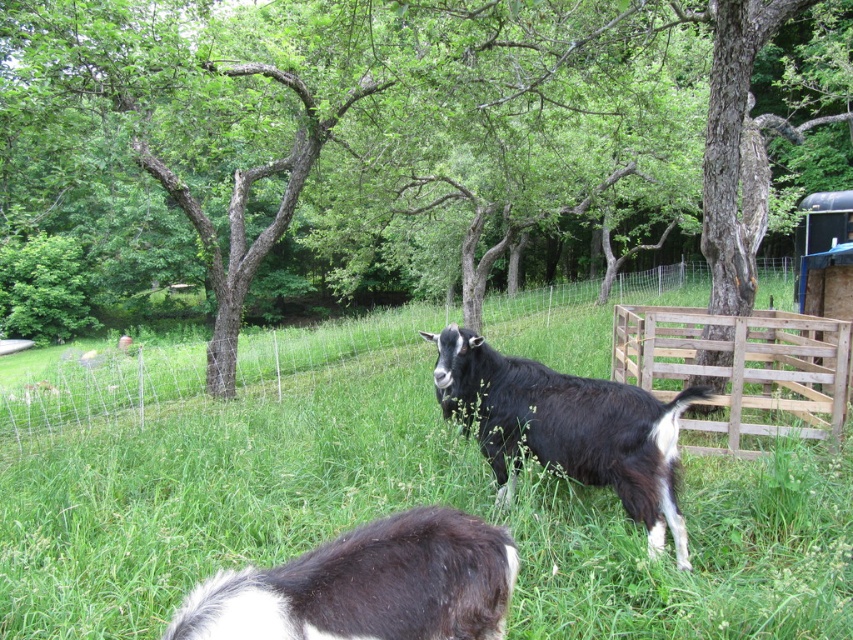
Between brown rough tree at center and wooden fence at center, which one has more height?

brown rough tree at center is taller.

Does brown rough tree at center have a greater height compared to wooden fence at center?

Indeed, brown rough tree at center has a greater height compared to wooden fence at center.

Between point (24, 230) and point (189, 378), which one is positioned behind?

The point (24, 230) is more distant.

Image resolution: width=853 pixels, height=640 pixels. I want to click on brown rough tree at center, so click(x=395, y=150).

Is point (469, 636) positioned after point (822, 355)?

No, (469, 636) is closer to viewer.

Who is more distant from viewer, (459, 624) or (825, 413)?

Point (825, 413)

Which is in front, point (303, 630) or point (770, 400)?

Point (303, 630) is more forward.

This screenshot has height=640, width=853. I want to click on black fuzzy goat at lower center, so click(367, 586).

What do you see at coordinates (395, 150) in the screenshot? I see `brown rough tree at center` at bounding box center [395, 150].

The image size is (853, 640). Find the location of `brown rough tree at center`. brown rough tree at center is located at coordinates (395, 150).

Locate an element on the screen. This screenshot has width=853, height=640. brown rough tree at center is located at coordinates (395, 150).